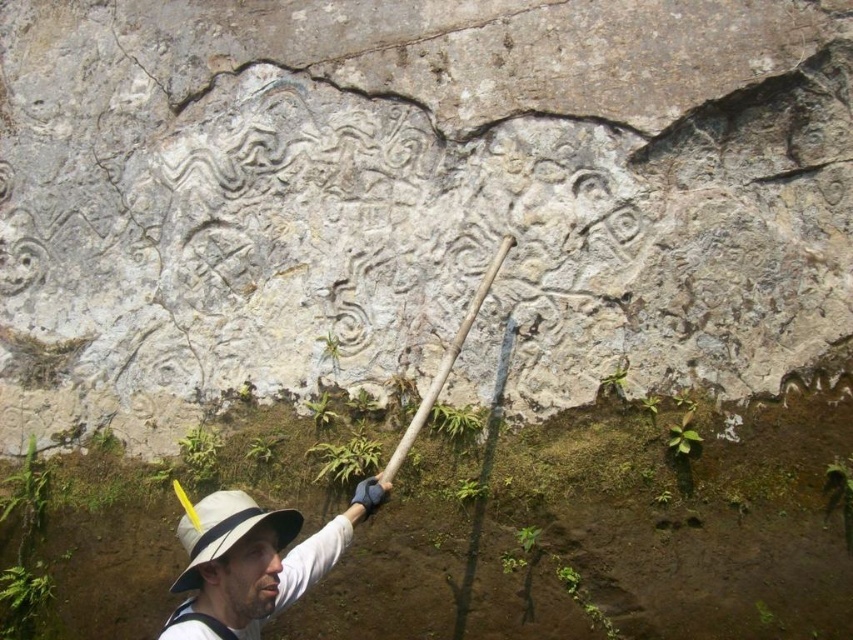
You are an archaeologist examining the site and need to identify which hat is taller. Which hat is taller between the white hat at center and the white fabric hat at lower left?

The white hat at center is much taller than the white fabric hat at lower left.

You are an archaeologist working at the site and need to place a protective cover over both the white hat at center and the wooden textured shovel at center. If the cover can only accommodate the wider object, which object should you prioritize covering?

The white hat at center should be prioritized because its width surpasses that of the wooden textured shovel at center, ensuring the cover fits over the wider object first.